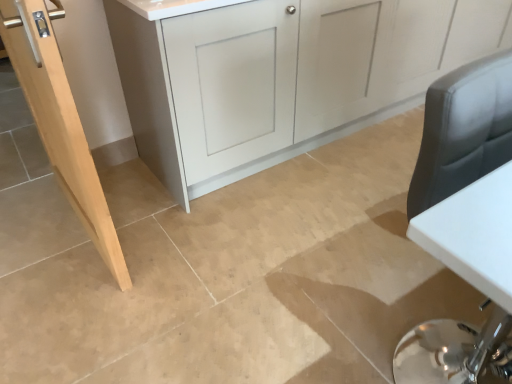
Question: Considering the relative sizes of natural wood door at left and matte gray cabinet at center in the image provided, is natural wood door at left shorter than matte gray cabinet at center?

Choices:
 (A) yes
 (B) no

Answer: (B)

Question: Considering the relative positions of natural wood door at left and matte gray cabinet at center in the image provided, is natural wood door at left behind matte gray cabinet at center?

Choices:
 (A) no
 (B) yes

Answer: (A)

Question: Does natural wood door at left have a greater height compared to matte gray cabinet at center?

Choices:
 (A) yes
 (B) no

Answer: (A)

Question: Does natural wood door at left have a lesser width compared to matte gray cabinet at center?

Choices:
 (A) yes
 (B) no

Answer: (A)

Question: Is natural wood door at left turned away from matte gray cabinet at center?

Choices:
 (A) yes
 (B) no

Answer: (A)

Question: From the image's perspective, is natural wood door at left located beneath matte gray cabinet at center?

Choices:
 (A) yes
 (B) no

Answer: (A)

Question: Can you confirm if matte gray cabinet at center is taller than natural wood door at left?

Choices:
 (A) no
 (B) yes

Answer: (A)

Question: Is matte gray cabinet at center further to the viewer compared to natural wood door at left?

Choices:
 (A) no
 (B) yes

Answer: (B)

Question: Does matte gray cabinet at center have a greater width compared to natural wood door at left?

Choices:
 (A) yes
 (B) no

Answer: (A)

Question: Can you confirm if matte gray cabinet at center is shorter than natural wood door at left?

Choices:
 (A) no
 (B) yes

Answer: (B)

Question: From a real-world perspective, is matte gray cabinet at center beneath natural wood door at left?

Choices:
 (A) no
 (B) yes

Answer: (B)

Question: Is matte gray cabinet at center smaller than natural wood door at left?

Choices:
 (A) yes
 (B) no

Answer: (B)

Question: Considering the relative positions of natural wood door at left and matte gray cabinet at center in the image provided, is natural wood door at left to the left or to the right of matte gray cabinet at center?

Choices:
 (A) left
 (B) right

Answer: (A)